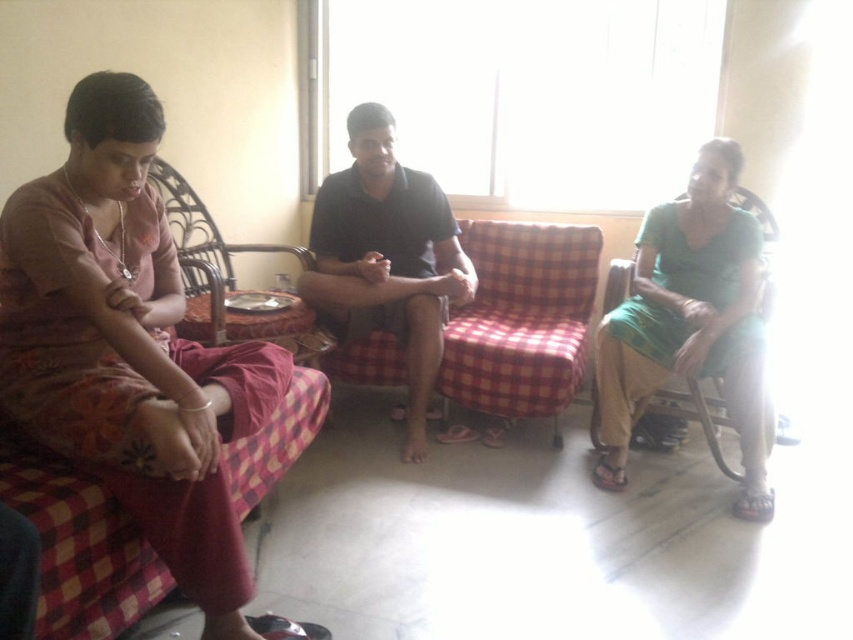
Measure the distance between point [199,476] and camera.

Point [199,476] is 4.64 feet from camera.

The image size is (853, 640). I want to click on matte pink dress at left, so tap(128, 348).

Does matte pink dress at left appear on the left side of red checkered fabric couch at center?

Yes, matte pink dress at left is to the left of red checkered fabric couch at center.

Which of these two, matte pink dress at left or red checkered fabric couch at center, stands shorter?

With less height is red checkered fabric couch at center.

Is point (109, 269) behind point (387, 381)?

No, it is not.

You are a GUI agent. You are given a task and a screenshot of the screen. Output one action in this format:
    pyautogui.click(x=<x>, y=<y>)
    Task: Click on the matte pink dress at left
    The width and height of the screenshot is (853, 640).
    Given the screenshot: What is the action you would take?
    pyautogui.click(x=128, y=348)

Who is taller, dark gray cotton shirt at center or wicker chair at left?

dark gray cotton shirt at center is taller.

Can you confirm if dark gray cotton shirt at center is positioned to the left of wicker chair at left?

No, dark gray cotton shirt at center is not to the left of wicker chair at left.

The width and height of the screenshot is (853, 640). Describe the element at coordinates (387, 257) in the screenshot. I see `dark gray cotton shirt at center` at that location.

At what (x,y) coordinates should I click in order to perform the action: click on dark gray cotton shirt at center. Please return your answer as a coordinate pair (x, y). Looking at the image, I should click on (387, 257).